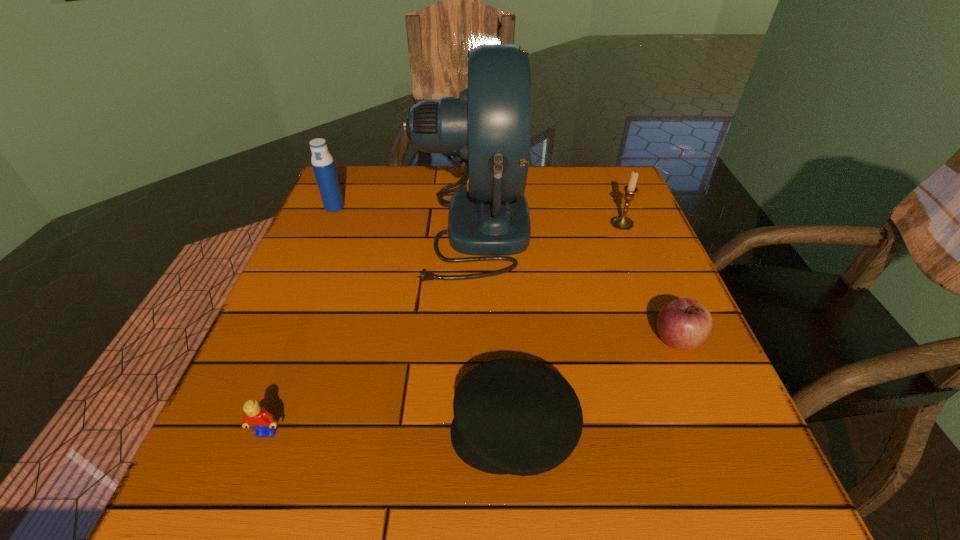
Where is `free spot between the fourth shortest object and the tallest object`? The image size is (960, 540). free spot between the fourth shortest object and the tallest object is located at coordinates (547, 226).

You are a GUI agent. You are given a task and a screenshot of the screen. Output one action in this format:
    pyautogui.click(x=<x>, y=<y>)
    Task: Click on the empty space between the Lego and the fifth shortest object
    
    Given the screenshot: What is the action you would take?
    pyautogui.click(x=300, y=320)

Where is `empty location between the fifth shortest object and the fan`? This screenshot has width=960, height=540. empty location between the fifth shortest object and the fan is located at coordinates (403, 218).

This screenshot has width=960, height=540. Identify the location of vacant space that is in between the fan and the fifth shortest object. (403, 218).

Where is `free spot between the beret and the fifth shortest object`? The image size is (960, 540). free spot between the beret and the fifth shortest object is located at coordinates (424, 319).

Find the location of `unoccupied position between the tallest object and the beret`. unoccupied position between the tallest object and the beret is located at coordinates (492, 330).

Locate an element on the screen. This screenshot has height=540, width=960. vacant space that's between the beret and the fifth shortest object is located at coordinates (424, 319).

Where is `vacant area between the fan and the Lego`? This screenshot has height=540, width=960. vacant area between the fan and the Lego is located at coordinates (370, 330).

The height and width of the screenshot is (540, 960). Find the location of `object that stands as the third closest to the tallest object`. object that stands as the third closest to the tallest object is located at coordinates (684, 324).

Choose which object is the fifth nearest neighbor to the candle holder. Please provide its 2D coordinates. Your answer should be formatted as a tuple, i.e. [(x, y)], where the tuple contains the x and y coordinates of a point satisfying the conditions above.

[(258, 418)]